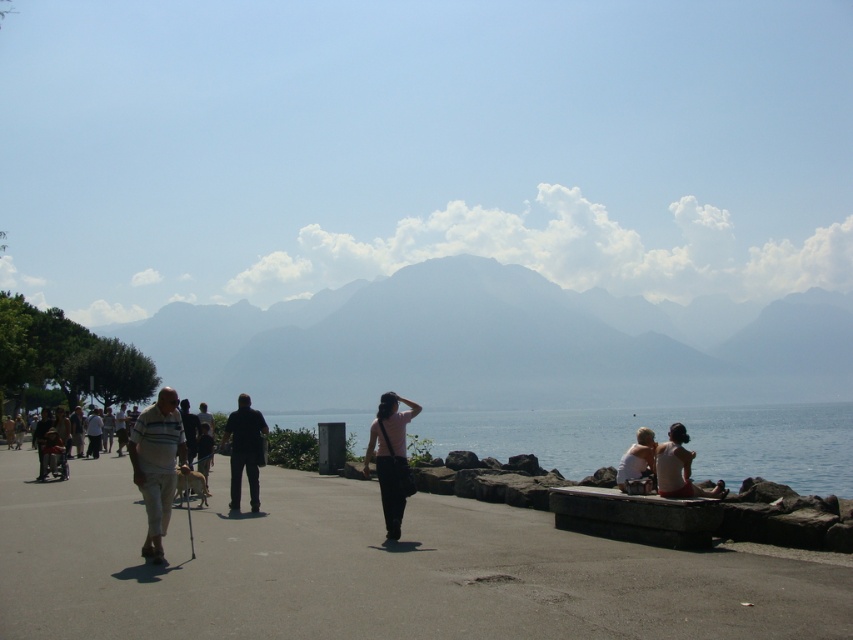
Consider the image. You are standing at the lakeside and want to take a photo of the gray foggy mountain at center and the light blue denim shorts at lower right. Which object should you focus on first if you want both to be in clear focus?

The gray foggy mountain at center is positioned over light blue denim shorts at lower right, so you should focus on the gray foggy mountain at center first to ensure both are in clear focus.

You are a hiker planning to take a photo of the gray foggy mountain at center and the light pink fabric at lower right. Which object should you focus on first to ensure both are in the frame?

The gray foggy mountain at center is positioned over the light pink fabric at lower right, so you should focus on the gray foggy mountain at center first to ensure both are in the frame.

Looking at this image, you are standing on the concrete sidewalk at center and want to reach the light pink fabric at lower right. Which direction should you move to get there?

You should move to the right, as the concrete sidewalk at center is to the left of light pink fabric at lower right.